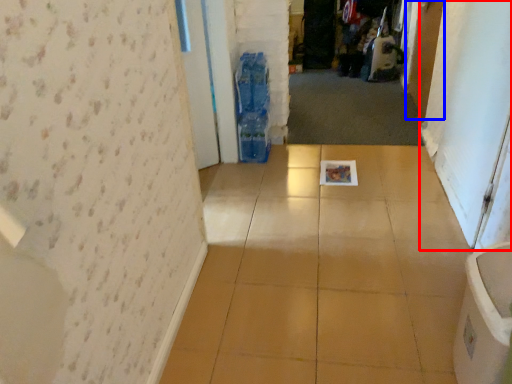
Question: Which object is further to the camera taking this photo, screen door (highlighted by a red box) or door (highlighted by a blue box)?

Choices:
 (A) screen door
 (B) door

Answer: (B)